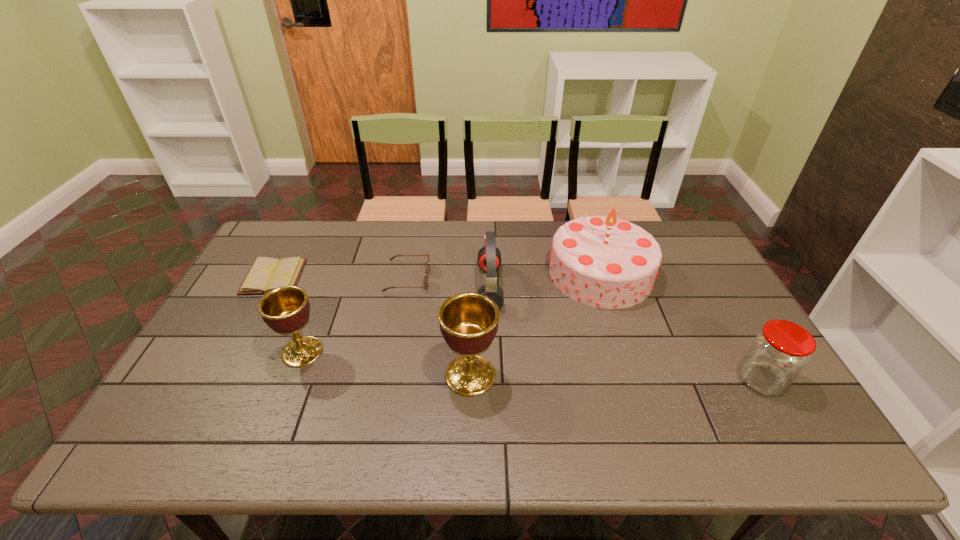
Locate an element on the screen. the second object from left to right is located at coordinates (286, 310).

Locate an element on the screen. the left chalice is located at coordinates (286, 310).

Locate an element on the screen. This screenshot has width=960, height=540. the taller chalice is located at coordinates (468, 321).

The height and width of the screenshot is (540, 960). Identify the location of the shortest object. (265, 274).

You are a GUI agent. You are given a task and a screenshot of the screen. Output one action in this format:
    pyautogui.click(x=<x>, y=<y>)
    Task: Click on the leftmost object
    
    Given the screenshot: What is the action you would take?
    pyautogui.click(x=265, y=274)

Identify the location of the second object from right to left. The width and height of the screenshot is (960, 540). (603, 262).

At what (x,y) coordinates should I click in order to perform the action: click on the fifth object from right to left. Please return your answer as a coordinate pair (x, y). This screenshot has height=540, width=960. Looking at the image, I should click on (426, 277).

Find the location of a particular element. The height and width of the screenshot is (540, 960). the second shortest object is located at coordinates (426, 277).

Find the location of a particular element. The width and height of the screenshot is (960, 540). earphone is located at coordinates (489, 256).

Locate an element on the screen. The height and width of the screenshot is (540, 960). the rightmost object is located at coordinates (778, 354).